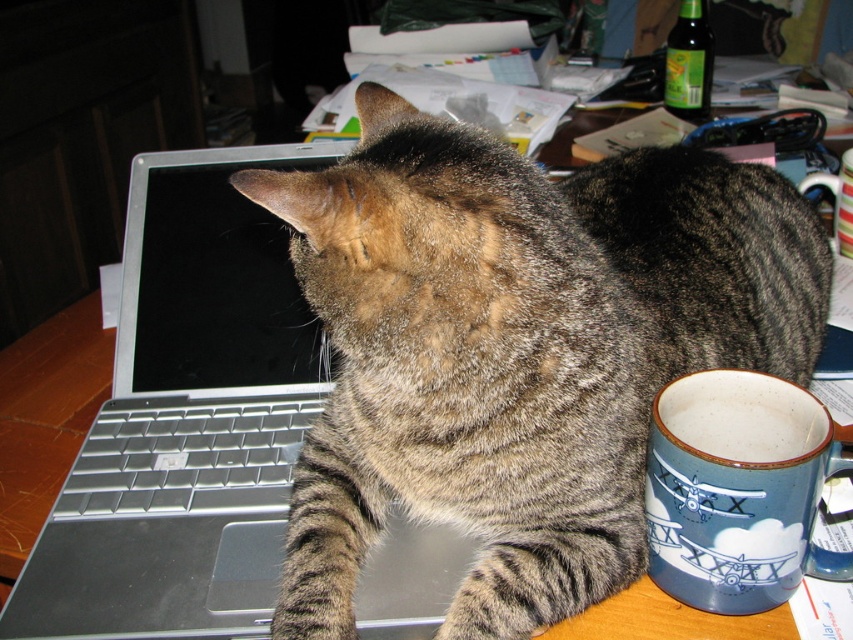
You are organizing a small space and need to place both the silver metallic laptop at center and the blue stoneware mug at lower right on a shelf. The shelf has limited space. Which object should you place first to ensure both fit?

The silver metallic laptop at center has a larger size compared to the blue stoneware mug at lower right. Therefore, you should place the silver metallic laptop at center first to ensure both items fit on the shelf.

You are a remote worker who needs to use your MacBook Pro. The tabby fur cat at center is blocking the keyboard. Can you move the blue ceramic mug at upper center out of the way to access the keyboard?

The tabby fur cat at center is below the blue ceramic mug at upper center, so moving the blue ceramic mug at upper center would not directly free up access to the keyboard since the cat is the one blocking it. You should first move the cat to access the keyboard.

You are trying to locate two points in the image. The first point is at coordinates point (56, 552) and the second point is at point (759, 518). From the perspective of someone sitting at the desk, which point is closer to the back of the desk?

Point (759, 518) is closer to the back of the desk because it is in front of point (56, 552), which is behind it.